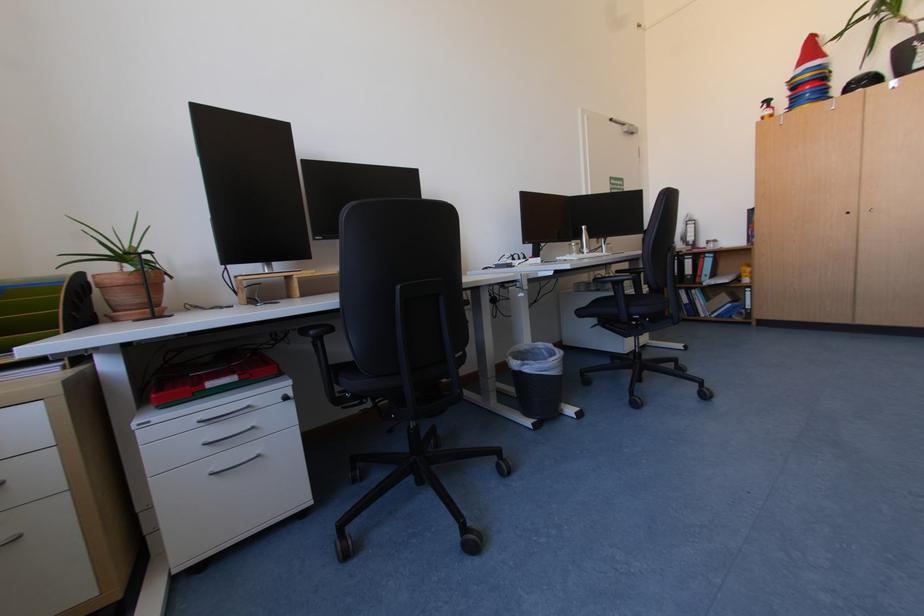
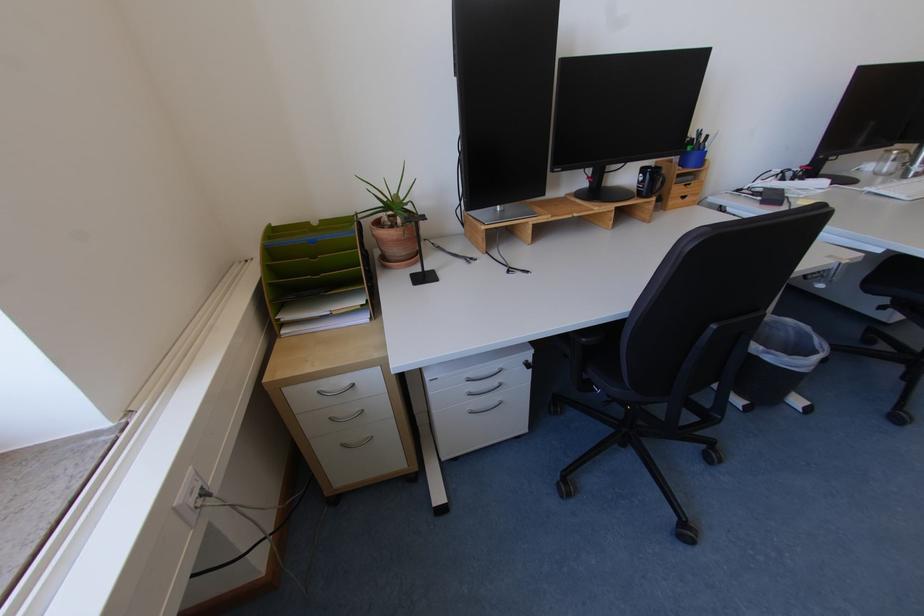
First-person continuous shooting, in which direction is the camera rotating?

The camera's rotation is toward left-down.